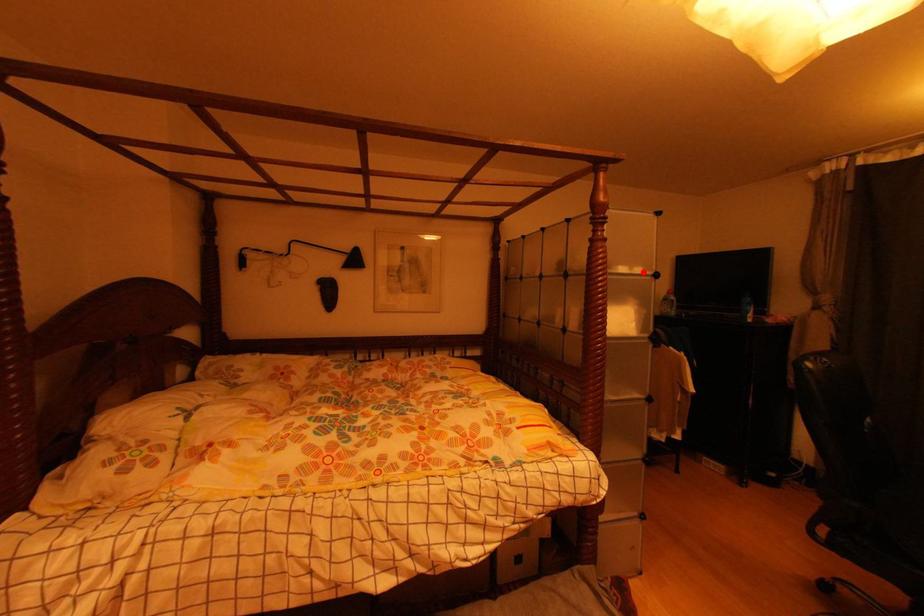
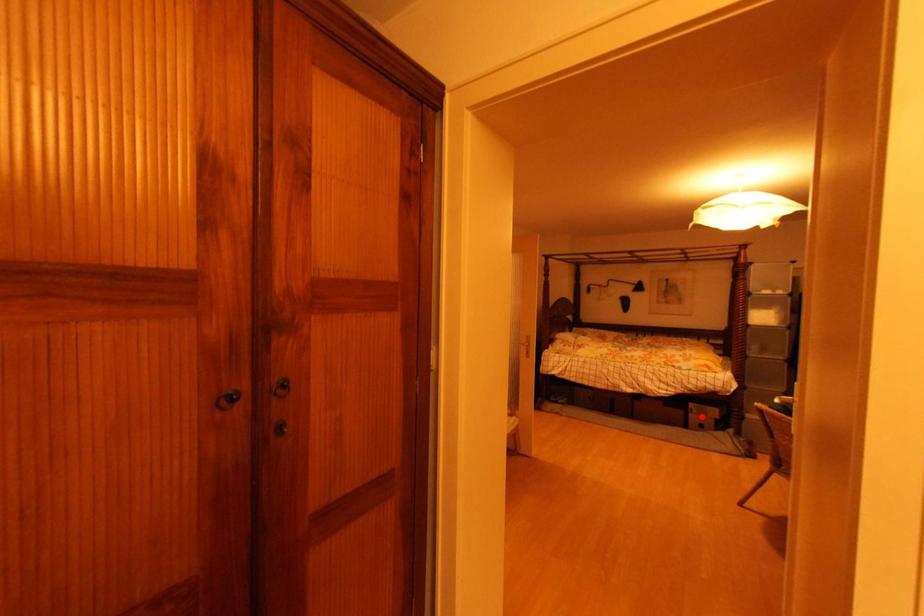
I am providing you with two images of the same scene from different viewpoints. A red point is marked on the first image and another point is marked on the second image. Is the marked point in image1 the same physical position as the marked point in image2?

No